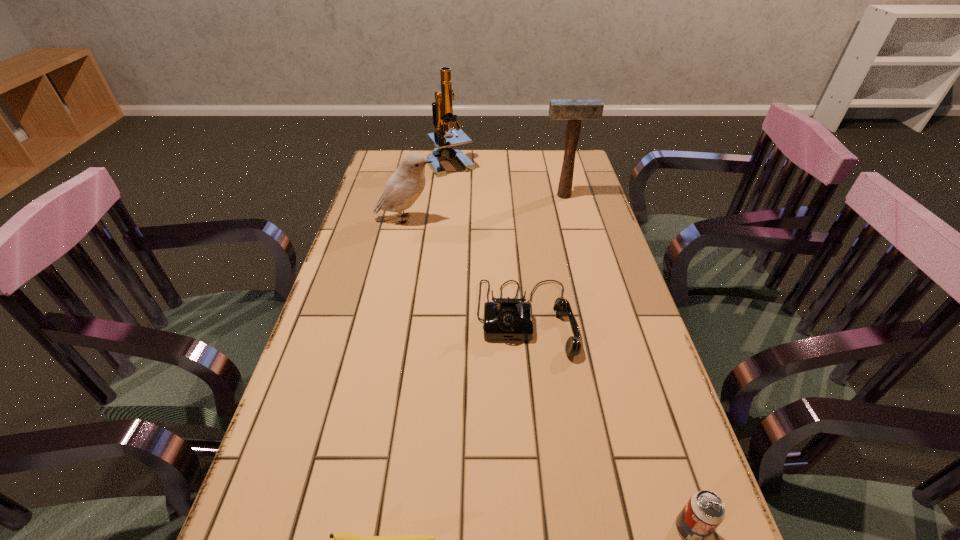
Locate an element on the screen. Image resolution: width=960 pixels, height=540 pixels. object at the left edge is located at coordinates (403, 188).

I want to click on object that is at the right edge, so click(574, 110).

The width and height of the screenshot is (960, 540). I want to click on vacant space at the left edge, so click(x=356, y=218).

Identify the location of free space at the right edge of the desktop. The image size is (960, 540). (587, 209).

Locate an element on the screen. free space at the far left corner of the desktop is located at coordinates (385, 170).

You are a GUI agent. You are given a task and a screenshot of the screen. Output one action in this format:
    pyautogui.click(x=<x>, y=<y>)
    Task: Click on the empty space between the farthest object and the telephone
    
    Given the screenshot: What is the action you would take?
    489,240

Identify the location of blank region between the bird and the third nearest object. This screenshot has width=960, height=540. (466, 269).

At what (x,y) coordinates should I click in order to perform the action: click on object that is the fifth closest one to the beer can. Please return your answer as a coordinate pair (x, y). This screenshot has width=960, height=540. Looking at the image, I should click on (442, 109).

You are a GUI agent. You are given a task and a screenshot of the screen. Output one action in this format:
    pyautogui.click(x=<x>, y=<y>)
    Task: Click on the third closest object to the fourth farthest object
    This screenshot has width=960, height=540.
    Given the screenshot: What is the action you would take?
    pyautogui.click(x=341, y=539)

At what (x,y) coordinates should I click in order to perform the action: click on free space in the image that satisfies the following two spatial constraints: 1. on the front side of the second farthest object; 2. at the beak of the bird. Please return your answer as a coordinate pair (x, y). The height and width of the screenshot is (540, 960). Looking at the image, I should click on (570, 219).